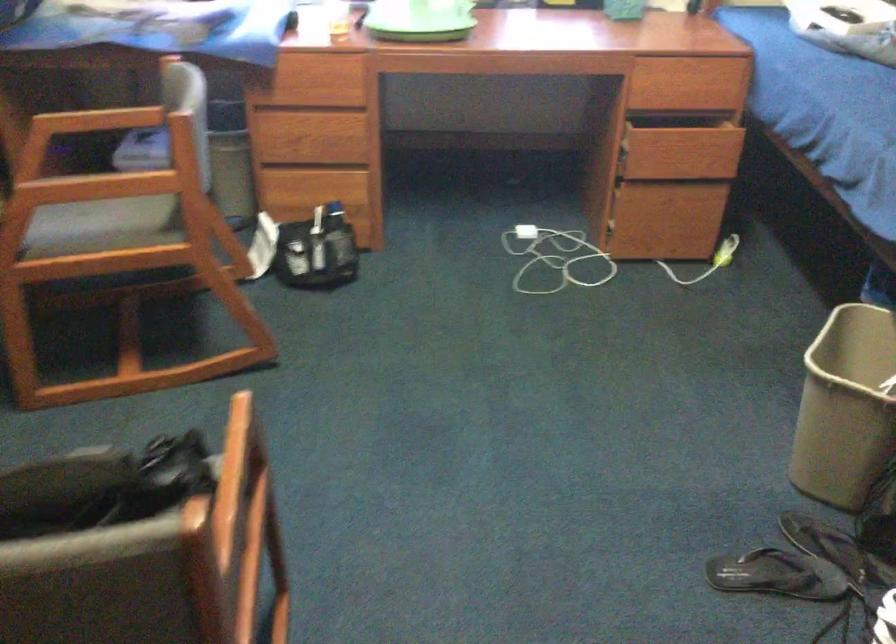
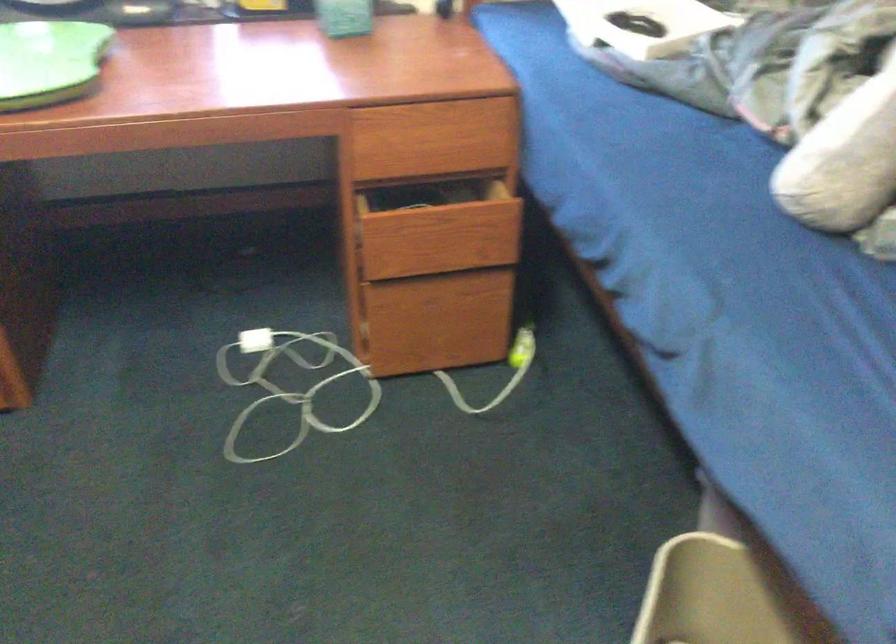
In a continuous first-person perspective shot, in which direction is the camera moving?

The cameraman walked toward right, forward.